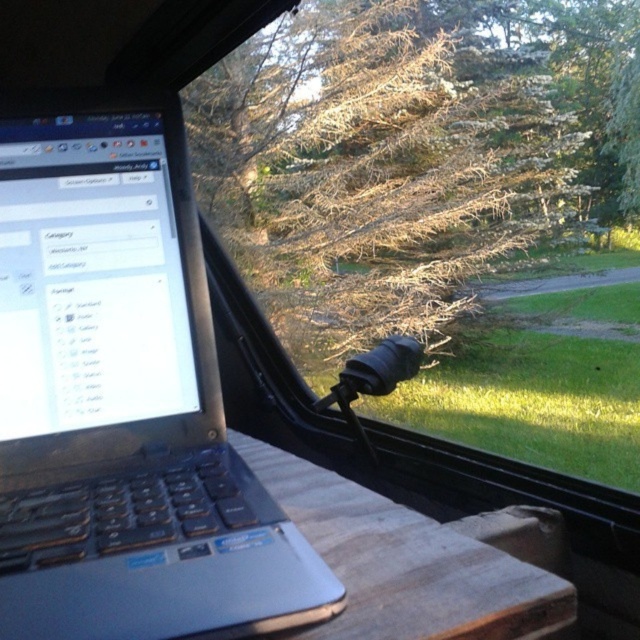
You are designing a layout for a mobile app that needs to display a notification icon in the top right corner of the screen. The notification icon must be placed at coordinates that are 0.623 on the x axis and 0.194 on the y axis. However, there is a slate gray plastic laptop at left at these coordinates. Can you place the notification icon there without overlapping the laptop?

The slate gray plastic laptop at left is already positioned at coordinates x 0.623 and y 0.194, so placing the notification icon there would overlap with the laptop.

You are inside a camper van and want to know how far the point at coordinates (221,502) is from your current position. Can you determine the distance?

The point at coordinates (221,502) is 44.83 centimeters from the camera, so the distance from your current position would depend on where you are standing inside the camper van. However, the point is 44.83 centimeters away from the camera position.